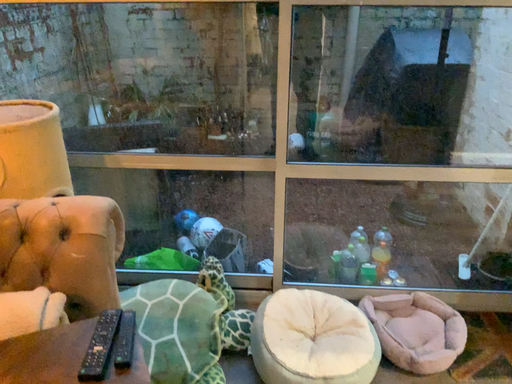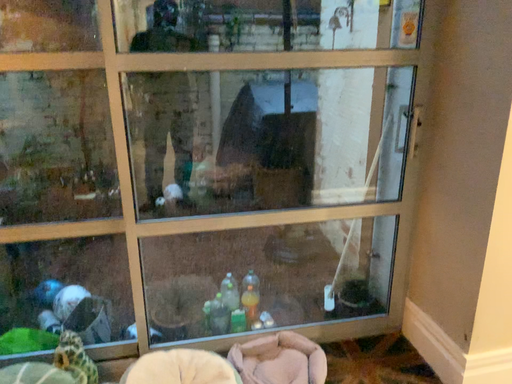
Question: Which way did the camera rotate in the video?

Choices:
 (A) rotated upward
 (B) rotated downward

Answer: (A)